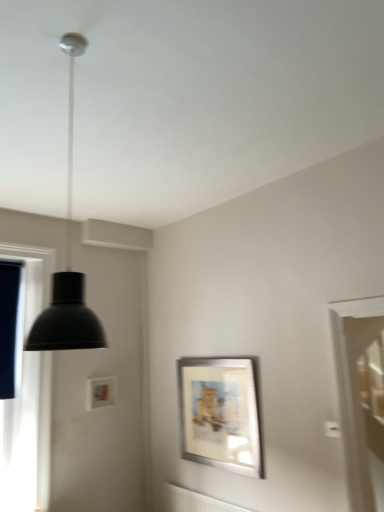
Describe the element at coordinates (367, 402) in the screenshot. I see `white glossy screen door at right` at that location.

Locate an element on the screen. white glossy screen door at right is located at coordinates (367, 402).

Locate an element on the screen. This screenshot has height=512, width=384. silver metallic picture frame at center is located at coordinates (220, 413).

From a real-world perspective, is silver metallic picture frame at center positioned under white glossy screen door at right based on gravity?

Indeed, from a real-world perspective, silver metallic picture frame at center is positioned beneath white glossy screen door at right.

Is silver metallic picture frame at center positioned far away from white glossy screen door at right?

Absolutely, silver metallic picture frame at center is distant from white glossy screen door at right.

Between silver metallic picture frame at center and white glossy screen door at right, which one has smaller width?

With smaller width is silver metallic picture frame at center.

Relative to white glossy screen door at right, is silver metallic picture frame at center in front or behind?

Visually, silver metallic picture frame at center is located in front of white glossy screen door at right.

Which is in front, matte black pendant light at upper left or silver metallic picture frame at center?

matte black pendant light at upper left is in front.

From the image's perspective, is matte black pendant light at upper left located above or below silver metallic picture frame at center?

matte black pendant light at upper left is situated higher than silver metallic picture frame at center in the image.

Based on the photo, which of these two, matte black pendant light at upper left or silver metallic picture frame at center, stands shorter?

silver metallic picture frame at center is shorter.

Is matte black pendant light at upper left spatially inside silver metallic picture frame at center, or outside of it?

matte black pendant light at upper left is not inside silver metallic picture frame at center, it's outside.

Is white glossy screen door at right at the right side of silver metallic picture frame at center?

Indeed, white glossy screen door at right is positioned on the right side of silver metallic picture frame at center.

From the image's perspective, is white glossy screen door at right on silver metallic picture frame at center?

Yes, from the image's perspective, white glossy screen door at right is over silver metallic picture frame at center.

Is white glossy screen door at right turned away from silver metallic picture frame at center?

No.

How different are the orientations of white glossy screen door at right and silver metallic picture frame at center in degrees?

The angular difference between white glossy screen door at right and silver metallic picture frame at center is 90.3 degrees.

Is matte black pendant light at upper left far from white glossy screen door at right?

Absolutely, matte black pendant light at upper left is distant from white glossy screen door at right.

Is matte black pendant light at upper left taller than white glossy screen door at right?

Yes, matte black pendant light at upper left is taller than white glossy screen door at right.

Visually, is matte black pendant light at upper left positioned to the left or to the right of white glossy screen door at right?

Clearly, matte black pendant light at upper left is on the left of white glossy screen door at right in the image.

Is white glossy screen door at right thinner than matte black pendant light at upper left?

In fact, white glossy screen door at right might be wider than matte black pendant light at upper left.

From the picture: Is white glossy screen door at right bigger or smaller than matte black pendant light at upper left?

Considering their sizes, white glossy screen door at right takes up more space than matte black pendant light at upper left.

From a real-world perspective, who is located lower, white glossy screen door at right or matte black pendant light at upper left?

white glossy screen door at right, from a real-world perspective.

Considering the sizes of objects silver metallic picture frame at center and matte black pendant light at upper left in the image provided, who is taller, silver metallic picture frame at center or matte black pendant light at upper left?

matte black pendant light at upper left.

Find the location of a particular element. The image size is (384, 512). picture frame on the right of matte black pendant light at upper left is located at coordinates (220, 413).

From the image's perspective, is silver metallic picture frame at center located above or below matte black pendant light at upper left?

Based on their image positions, silver metallic picture frame at center is located beneath matte black pendant light at upper left.

Which is more to the left, silver metallic picture frame at center or matte black pendant light at upper left?

Positioned to the left is matte black pendant light at upper left.

This screenshot has width=384, height=512. Identify the location of screen door above the silver metallic picture frame at center (from a real-world perspective). (367, 402).

You are a GUI agent. You are given a task and a screenshot of the screen. Output one action in this format:
    pyautogui.click(x=<x>, y=<y>)
    Task: Click on the lamp that is on the left side of silver metallic picture frame at center
    This screenshot has height=512, width=384.
    Given the screenshot: What is the action you would take?
    pyautogui.click(x=68, y=264)

Estimate the real-world distances between objects in this image. Which object is further from matte black pendant light at upper left, silver metallic picture frame at center or white glossy screen door at right?

white glossy screen door at right lies further to matte black pendant light at upper left than the other object.

Looking at the image, which one is located closer to white glossy screen door at right, matte black pendant light at upper left or silver metallic picture frame at center?

The object closer to white glossy screen door at right is silver metallic picture frame at center.

Based on their spatial positions, is white glossy screen door at right or matte black pendant light at upper left closer to silver metallic picture frame at center?

white glossy screen door at right is positioned closer to the anchor silver metallic picture frame at center.

Which object lies further to the anchor point silver metallic picture frame at center, matte black pendant light at upper left or white glossy screen door at right?

matte black pendant light at upper left is further to silver metallic picture frame at center.

Considering their positions, is silver metallic picture frame at center positioned closer to white glossy screen door at right than matte black pendant light at upper left?

silver metallic picture frame at center.

Estimate the real-world distances between objects in this image. Which object is closer to matte black pendant light at upper left, white glossy screen door at right or silver metallic picture frame at center?

The object closer to matte black pendant light at upper left is silver metallic picture frame at center.

The height and width of the screenshot is (512, 384). In order to click on picture frame between matte black pendant light at upper left and white glossy screen door at right in this screenshot , I will do `click(220, 413)`.